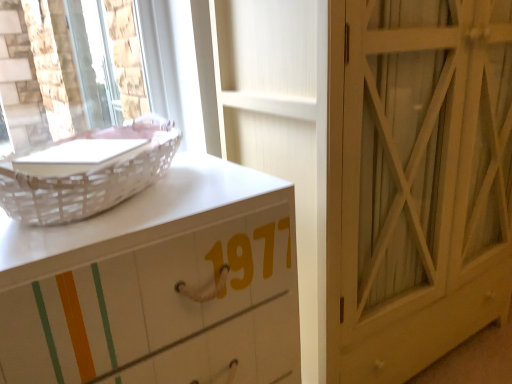
Locate an element on the screen. white wood door at center-right is located at coordinates (416, 181).

The image size is (512, 384). Find the location of `basket above the white wood door at center-right (from a real-world perspective)`. basket above the white wood door at center-right (from a real-world perspective) is located at coordinates (91, 177).

From a real-world perspective, is white wood door at center-right physically located above or below white wicker basket at upper left?

Clearly, from a real-world perspective, white wood door at center-right is below white wicker basket at upper left.

Considering the sizes of white wood door at center-right and white wicker basket at upper left in the image, is white wood door at center-right wider or thinner than white wicker basket at upper left?

In the image, white wood door at center-right appears to be wider than white wicker basket at upper left.

Which is closer, (394,140) or (45,188)?

Point (394,140) is positioned farther from the camera compared to point (45,188).

Is white wood door at center-right surrounded by white wicker basket at upper left?

Actually, white wood door at center-right is outside white wicker basket at upper left.

Considering the relative positions of white wicker basket at upper left and white wood door at center-right in the image provided, is white wicker basket at upper left to the right of white wood door at center-right from the viewer's perspective?

In fact, white wicker basket at upper left is to the left of white wood door at center-right.

Which object is closer to the camera taking this photo, white wicker basket at upper left or white wood door at center-right?

Positioned in front is white wicker basket at upper left.

Locate an element on the screen. basket on the left of the white wood door at center-right is located at coordinates (91, 177).

Where is `basket above the white painted wood chest of drawers at left (from a real-world perspective)`? basket above the white painted wood chest of drawers at left (from a real-world perspective) is located at coordinates (91, 177).

Is white wicker basket at upper left thinner than white painted wood chest of drawers at left?

Indeed, white wicker basket at upper left has a lesser width compared to white painted wood chest of drawers at left.

Between point (144, 162) and point (52, 242), which one is positioned behind?

Point (144, 162)

Which is more to the right, white wicker basket at upper left or white painted wood chest of drawers at left?

From the viewer's perspective, white painted wood chest of drawers at left appears more on the right side.

Considering the points (276, 200) and (337, 90), which point is in front, point (276, 200) or point (337, 90)?

The point (337, 90) is closer to the camera.

Which is in front, white painted wood chest of drawers at left or white wood door at center-right?

white painted wood chest of drawers at left is in front.

In the scene shown: From a real-world perspective, who is located lower, white painted wood chest of drawers at left or white wood door at center-right?

white painted wood chest of drawers at left, from a real-world perspective.

Considering the relative sizes of white wood door at center-right and white painted wood chest of drawers at left in the image provided, is white wood door at center-right thinner than white painted wood chest of drawers at left?

No.

In the scene shown: From a real-world perspective, is white wood door at center-right above or below white painted wood chest of drawers at left?

From a real-world perspective, white wood door at center-right is physically above white painted wood chest of drawers at left.

Are white wood door at center-right and white painted wood chest of drawers at left far apart?

That's not correct — white wood door at center-right is a little close to white painted wood chest of drawers at left.

Where is `door located above the white painted wood chest of drawers at left (from the image's perspective)`? door located above the white painted wood chest of drawers at left (from the image's perspective) is located at coordinates (416, 181).

From the picture: Which is in front, white painted wood chest of drawers at left or white wicker basket at upper left?

Positioned in front is white painted wood chest of drawers at left.

Is white painted wood chest of drawers at left bigger or smaller than white wicker basket at upper left?

In the image, white painted wood chest of drawers at left appears to be larger than white wicker basket at upper left.

Is white painted wood chest of drawers at left wider or thinner than white wicker basket at upper left?

In the image, white painted wood chest of drawers at left appears to be wider than white wicker basket at upper left.

Does white painted wood chest of drawers at left have a greater height compared to white wicker basket at upper left?

Indeed, white painted wood chest of drawers at left has a greater height compared to white wicker basket at upper left.

Identify the location of door directly beneath the white wicker basket at upper left (from a real-world perspective). (416, 181).

You are a GUI agent. You are given a task and a screenshot of the screen. Output one action in this format:
    pyautogui.click(x=<x>, y=<y>)
    Task: Click on the door behind the white wicker basket at upper left
    This screenshot has height=384, width=512.
    Given the screenshot: What is the action you would take?
    pyautogui.click(x=416, y=181)

From the image, which object appears to be farther from white painted wood chest of drawers at left, white wood door at center-right or white wicker basket at upper left?

Based on the image, white wood door at center-right appears to be further to white painted wood chest of drawers at left.

Based on their spatial positions, is white wood door at center-right or white painted wood chest of drawers at left further from white wicker basket at upper left?

The object further to white wicker basket at upper left is white wood door at center-right.

When comparing their distances from white wood door at center-right, does white painted wood chest of drawers at left or white wicker basket at upper left seem closer?

white painted wood chest of drawers at left.

From the image, which object appears to be farther from white wood door at center-right, white wicker basket at upper left or white painted wood chest of drawers at left?

The object further to white wood door at center-right is white wicker basket at upper left.

Based on their spatial positions, is white painted wood chest of drawers at left or white wood door at center-right closer to white wicker basket at upper left?

Among the two, white painted wood chest of drawers at left is located nearer to white wicker basket at upper left.

From the image, which object appears to be nearer to white painted wood chest of drawers at left, white wicker basket at upper left or white wood door at center-right?

white wicker basket at upper left.

Where is `the chest of drawers situated between white wicker basket at upper left and white wood door at center-right from left to right`? The width and height of the screenshot is (512, 384). the chest of drawers situated between white wicker basket at upper left and white wood door at center-right from left to right is located at coordinates (157, 285).